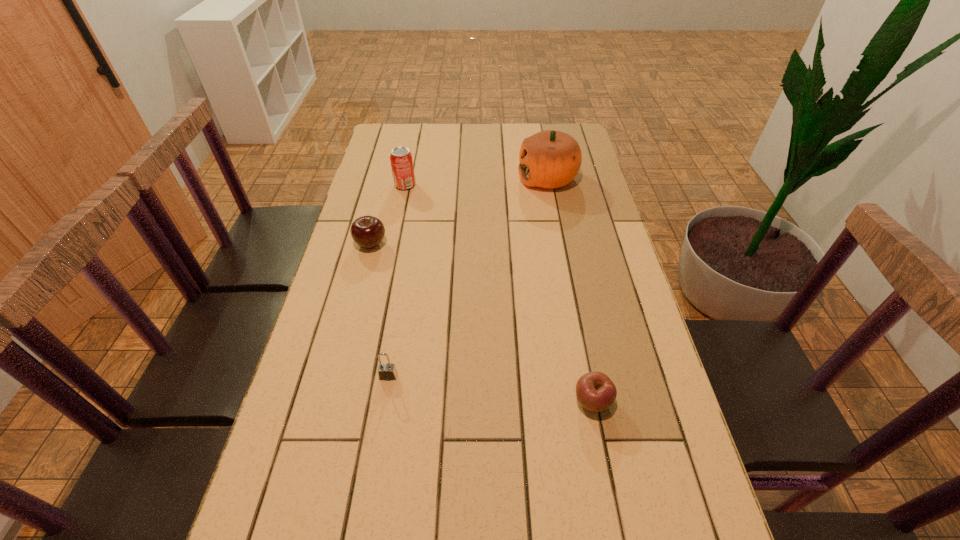
Identify the location of pumpkin. (549, 159).

At what (x,y) coordinates should I click in order to perform the action: click on soda can. Please return your answer as a coordinate pair (x, y). Looking at the image, I should click on (401, 160).

The image size is (960, 540). I want to click on the farther apple, so click(368, 232).

This screenshot has height=540, width=960. In order to click on the third farthest object in this screenshot , I will do tap(368, 232).

I want to click on the fourth farthest object, so click(x=386, y=371).

The width and height of the screenshot is (960, 540). I want to click on the shorter apple, so click(x=595, y=391).

The width and height of the screenshot is (960, 540). I want to click on the nearest object, so click(x=595, y=391).

You are a GUI agent. You are given a task and a screenshot of the screen. Output one action in this format:
    pyautogui.click(x=<x>, y=<y>)
    Task: Click on the free space located 0.080m on the face of the pumpkin
    The image size is (960, 540).
    Given the screenshot: What is the action you would take?
    click(495, 178)

Locate an element on the screen. free location located 0.170m on the face of the pumpkin is located at coordinates (469, 178).

Identify the location of vacant point located 0.340m on the face of the pumpkin. This screenshot has width=960, height=540. (422, 178).